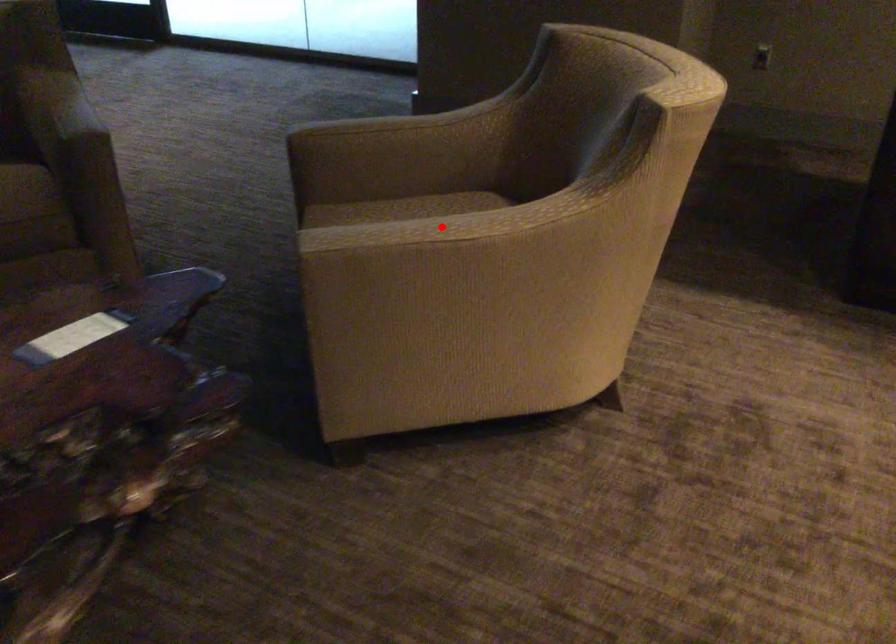
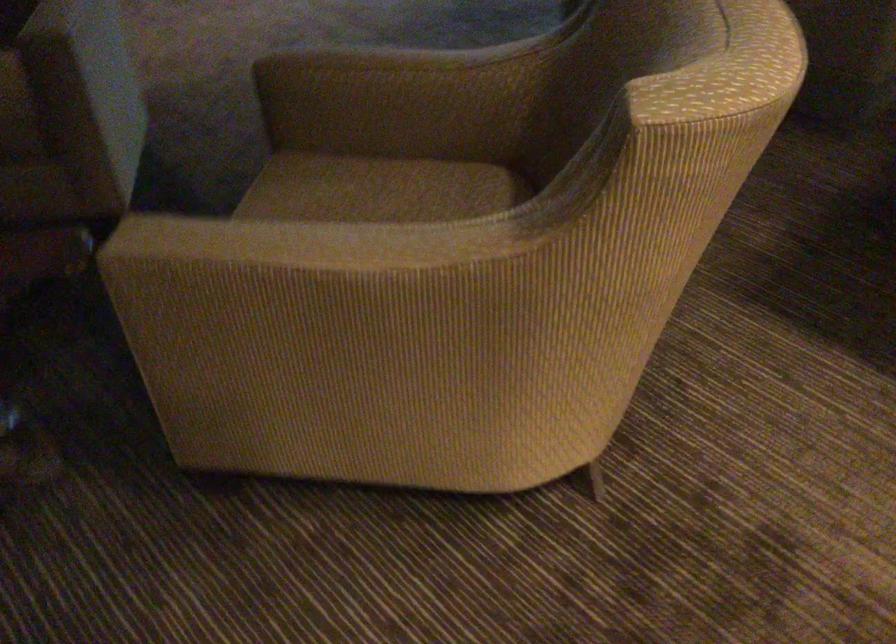
The point at the highlighted location is marked in the first image. Where is the corresponding point in the second image?

(298, 243)